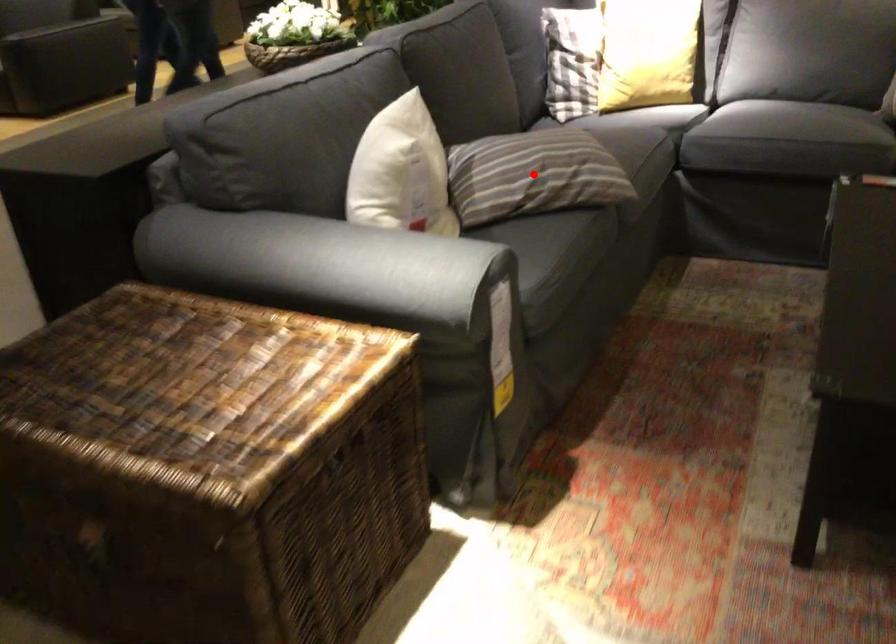
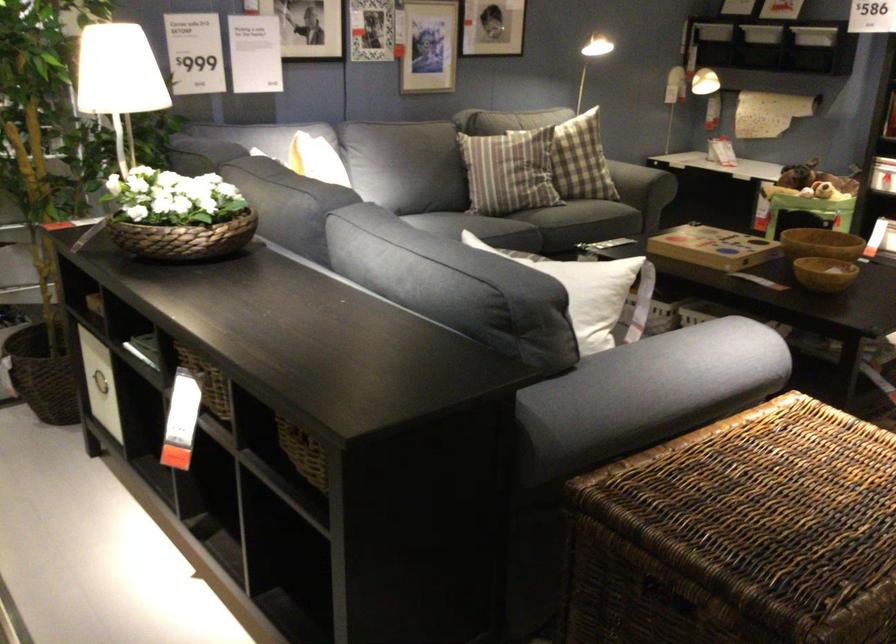
Question: I am providing you with two images of the same scene from different viewpoints. A red point is marked on the first image. Is the red point's position out of view in image 2?

Choices:
 (A) Yes
 (B) No

Answer: (A)